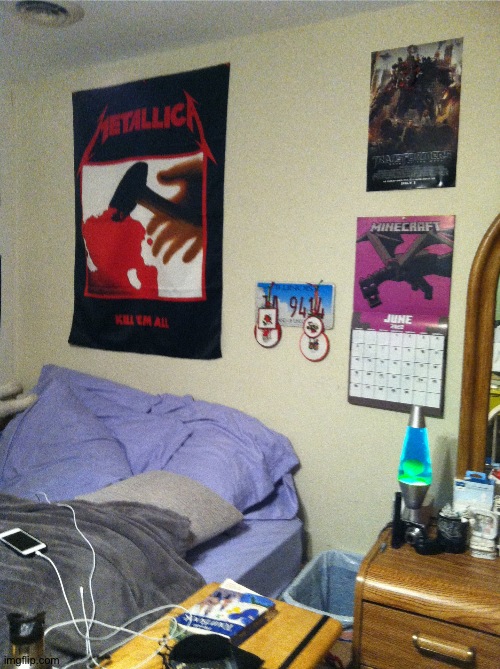
Locate an element on the screen. table is located at coordinates (274, 630).